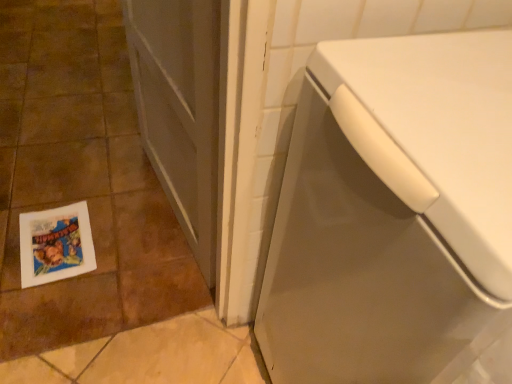
Question: Is there a large distance between white glossy tile at lower left and matte gray screen door at center?

Choices:
 (A) no
 (B) yes

Answer: (A)

Question: Does white glossy tile at lower left have a larger size compared to matte gray screen door at center?

Choices:
 (A) no
 (B) yes

Answer: (B)

Question: Is white glossy tile at lower left positioned beyond the bounds of matte gray screen door at center?

Choices:
 (A) no
 (B) yes

Answer: (B)

Question: Considering the relative positions of white glossy tile at lower left and matte gray screen door at center in the image provided, is white glossy tile at lower left to the right of matte gray screen door at center from the viewer's perspective?

Choices:
 (A) no
 (B) yes

Answer: (A)

Question: From the image's perspective, would you say white glossy tile at lower left is positioned over matte gray screen door at center?

Choices:
 (A) no
 (B) yes

Answer: (B)

Question: Does white glossy tile at lower left lie in front of matte gray screen door at center?

Choices:
 (A) no
 (B) yes

Answer: (A)

Question: Is white glossy washing machine at lower right thinner than matte gray screen door at center?

Choices:
 (A) yes
 (B) no

Answer: (B)

Question: Is white glossy washing machine at lower right aimed at matte gray screen door at center?

Choices:
 (A) no
 (B) yes

Answer: (A)

Question: Considering the relative sizes of white glossy washing machine at lower right and matte gray screen door at center in the image provided, is white glossy washing machine at lower right bigger than matte gray screen door at center?

Choices:
 (A) no
 (B) yes

Answer: (B)

Question: Is white glossy washing machine at lower right further to camera compared to matte gray screen door at center?

Choices:
 (A) yes
 (B) no

Answer: (B)

Question: From a real-world perspective, is white glossy washing machine at lower right located higher than matte gray screen door at center?

Choices:
 (A) no
 (B) yes

Answer: (B)

Question: Can you confirm if white glossy washing machine at lower right is shorter than matte gray screen door at center?

Choices:
 (A) yes
 (B) no

Answer: (B)

Question: Is matte gray screen door at center not inside white paper flyer at lower left?

Choices:
 (A) yes
 (B) no

Answer: (A)